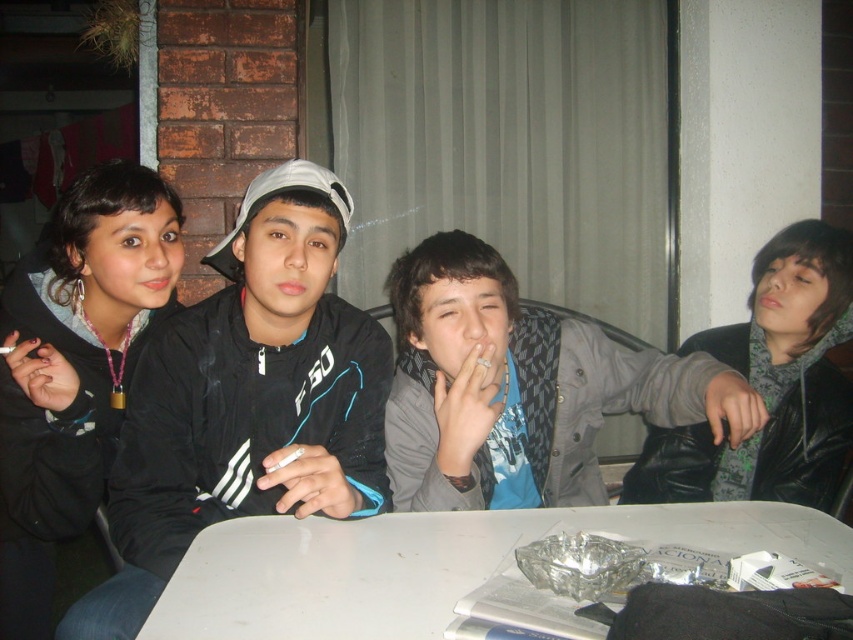
Who is more distant from viewer, (155,337) or (798,552)?

Positioned behind is point (155,337).

Does black matte jacket at center appear under white plastic table at lower center?

Incorrect, black matte jacket at center is not positioned below white plastic table at lower center.

Does point (331, 330) come behind point (596, 515)?

Yes, it is behind point (596, 515).

You are a GUI agent. You are given a task and a screenshot of the screen. Output one action in this format:
    pyautogui.click(x=<x>, y=<y>)
    Task: Click on the black matte jacket at center
    
    Given the screenshot: What is the action you would take?
    pyautogui.click(x=247, y=400)

Does point (407, 336) come behind point (329, 602)?

Yes, it is.

You are a GUI agent. You are given a task and a screenshot of the screen. Output one action in this format:
    pyautogui.click(x=<x>, y=<y>)
    Task: Click on the gray matte jacket at center
    The image size is (853, 640).
    Given the screenshot: What is the action you would take?
    pyautogui.click(x=521, y=388)

Can you confirm if black matte jacket at center is positioned to the right of gray matte jacket at center?

Incorrect, black matte jacket at center is not on the right side of gray matte jacket at center.

Is black matte jacket at center behind gray matte jacket at center?

No.

What do you see at coordinates (247, 400) in the screenshot?
I see `black matte jacket at center` at bounding box center [247, 400].

Image resolution: width=853 pixels, height=640 pixels. Identify the location of black matte jacket at center. (247, 400).